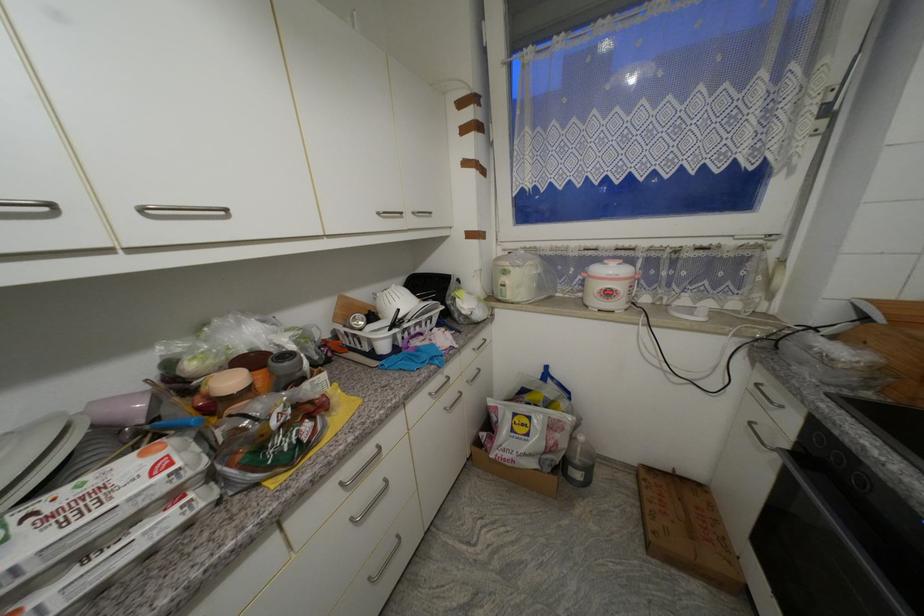
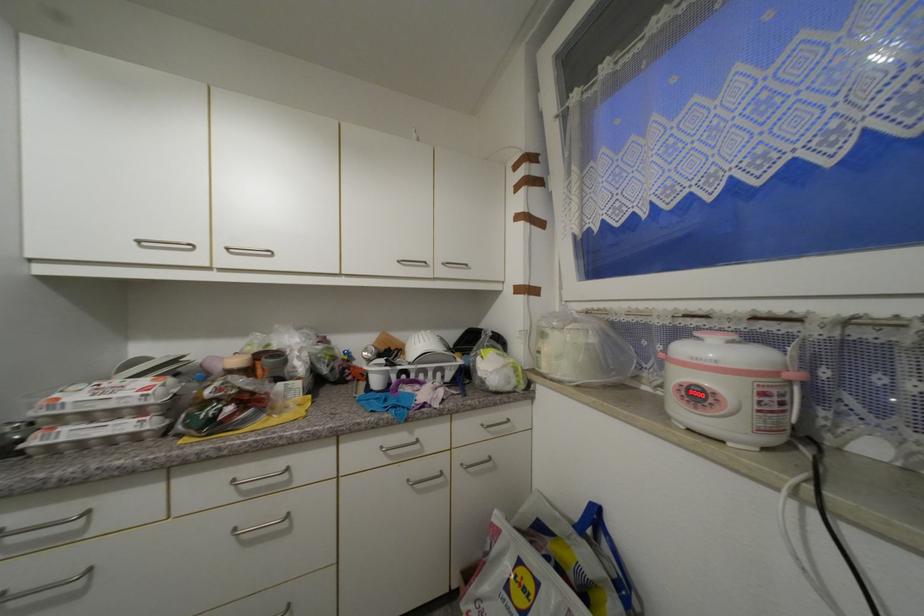
In the second image, find the point that corresponds to (480,351) in the first image.

(488, 427)